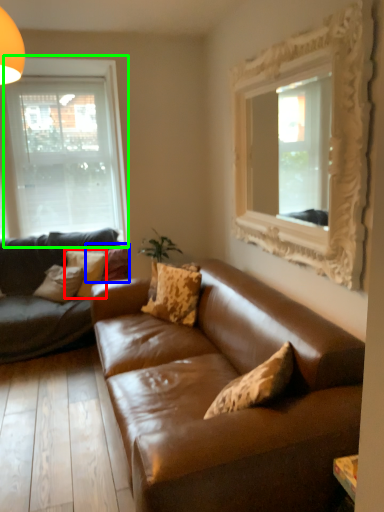
Question: Based on their relative distances, which object is nearer to pillow (highlighted by a red box)? Choose from pillow (highlighted by a blue box) and window (highlighted by a green box).

Choices:
 (A) pillow
 (B) window

Answer: (A)